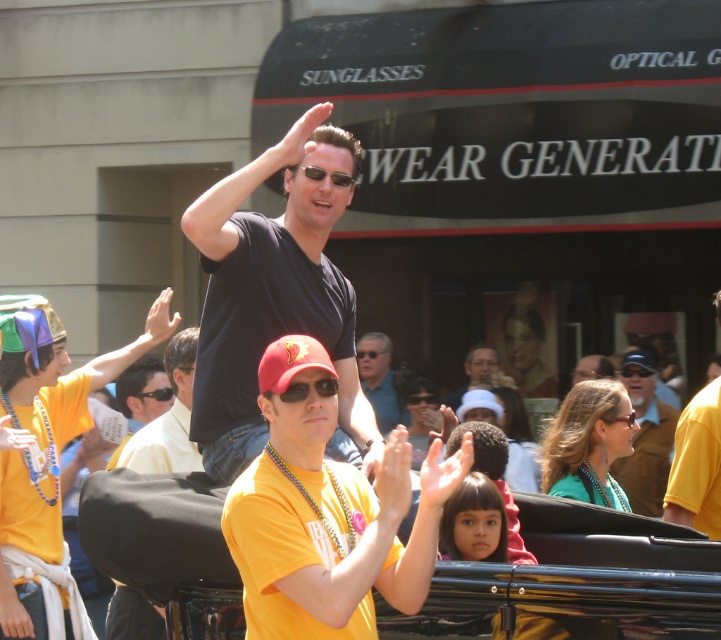
Question: Can you confirm if yellow matte shirt at center is wider than matte brown jacket at center?

Choices:
 (A) yes
 (B) no

Answer: (A)

Question: Which object appears farthest from the camera in this image?

Choices:
 (A) matte black shirt at center
 (B) matte brown jacket at center

Answer: (A)

Question: Is shiny black convertible at center further to camera compared to black matte t-shirt at upper center?

Choices:
 (A) no
 (B) yes

Answer: (A)

Question: Among these points, which one is farthest from the camera?

Choices:
 (A) (699, 426)
 (B) (557, 602)

Answer: (A)

Question: Is yellow fabric shirt at center above matte black shirt at center?

Choices:
 (A) no
 (B) yes

Answer: (A)

Question: Which point is farther to the camera?

Choices:
 (A) (660, 554)
 (B) (715, 467)
 (C) (143, 620)

Answer: (B)